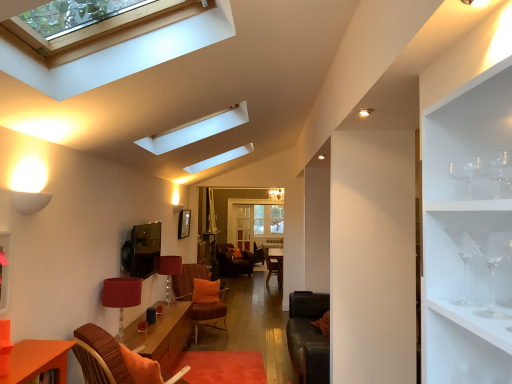
Question: From a real-world perspective, is orange fabric swivel chair at center, placed as the 2th swivel chair when sorted from front to back, located beneath pink matte shelf at left?

Choices:
 (A) yes
 (B) no

Answer: (A)

Question: Is orange fabric swivel chair at center, placed as the 2th swivel chair when sorted from front to back, to the right of pink matte shelf at left from the viewer's perspective?

Choices:
 (A) no
 (B) yes

Answer: (B)

Question: Can you confirm if orange fabric swivel chair at center, placed as the 2th swivel chair when sorted from front to back, is positioned to the left of pink matte shelf at left?

Choices:
 (A) no
 (B) yes

Answer: (A)

Question: Is the position of orange fabric swivel chair at center, placed as the 1th swivel chair when sorted from back to front, less distant than that of pink matte shelf at left?

Choices:
 (A) yes
 (B) no

Answer: (B)

Question: Can pink matte shelf at left be found inside orange fabric swivel chair at center, placed as the 1th swivel chair when sorted from back to front?

Choices:
 (A) no
 (B) yes

Answer: (A)

Question: From a real-world perspective, is orange fabric swivel chair at center, placed as the 1th swivel chair when sorted from back to front, on pink matte shelf at left?

Choices:
 (A) no
 (B) yes

Answer: (A)

Question: Does clear glass wine glass at right, which is counted as the third wine glass, starting from the front, have a greater width compared to pink matte shelf at left?

Choices:
 (A) yes
 (B) no

Answer: (A)

Question: Is clear glass wine glass at right, the 1th wine glass in the back-to-front sequence, further to the viewer compared to pink matte shelf at left?

Choices:
 (A) yes
 (B) no

Answer: (B)

Question: Is clear glass wine glass at right, the 1th wine glass in the back-to-front sequence, at the left side of pink matte shelf at left?

Choices:
 (A) yes
 (B) no

Answer: (B)

Question: Is pink matte shelf at left at the back of clear glass wine glass at right, which is counted as the third wine glass, starting from the front?

Choices:
 (A) yes
 (B) no

Answer: (B)

Question: Could you tell me if clear glass wine glass at right, which is counted as the third wine glass, starting from the front, is turned towards pink matte shelf at left?

Choices:
 (A) yes
 (B) no

Answer: (B)

Question: Is clear glass wine glass at right, the 1th wine glass in the back-to-front sequence, positioned far away from pink matte shelf at left?

Choices:
 (A) no
 (B) yes

Answer: (B)

Question: Is clear glass skylight at upper center outside of clear glass wine glass at upper right, which is the 2th wine glass from front to back?

Choices:
 (A) yes
 (B) no

Answer: (A)